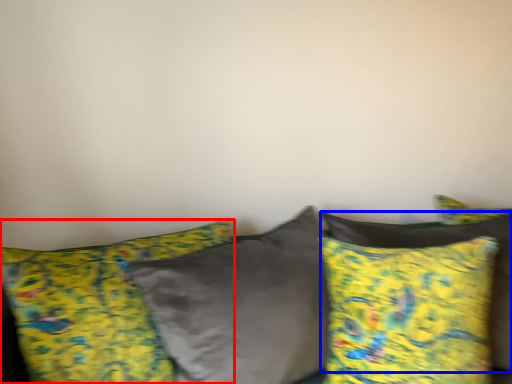
Question: Which point is closer to the camera, pillow (highlighted by a red box) or pillow (highlighted by a blue box)?

Choices:
 (A) pillow
 (B) pillow

Answer: (A)